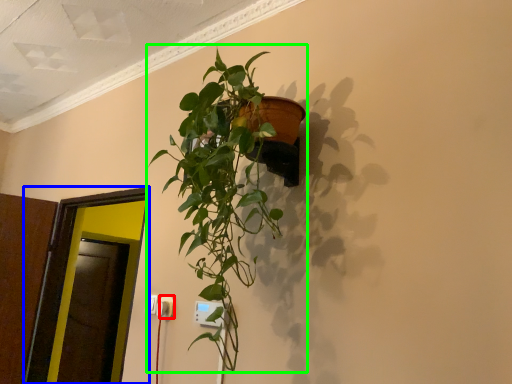
Question: Which object is the farthest from electric outlet (highlighted by a red box)? Choose among these: glass door (highlighted by a blue box) or houseplant (highlighted by a green box).

Choices:
 (A) glass door
 (B) houseplant

Answer: (A)